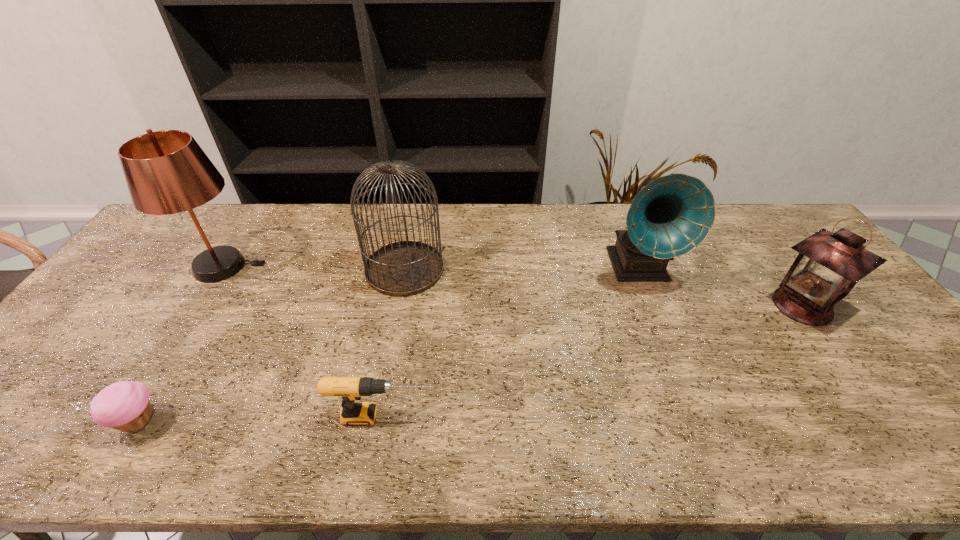
Find the location of a particular element. The width and height of the screenshot is (960, 540). vacant area situated 0.380m on the back of the oil lamp is located at coordinates (731, 207).

Identify the location of vacant area situated on the handle side of the fifth tallest object. (467, 416).

Locate an element on the screen. vacant position located 0.210m on the left of the cupcake is located at coordinates (21, 422).

You are a GUI agent. You are given a task and a screenshot of the screen. Output one action in this format:
    pyautogui.click(x=<x>, y=<y>)
    Task: Click on the lampshade that is at the far edge
    
    Given the screenshot: What is the action you would take?
    pyautogui.click(x=167, y=172)

You are a GUI agent. You are given a task and a screenshot of the screen. Output one action in this format:
    pyautogui.click(x=<x>, y=<y>)
    Task: Click on the birdcage that is at the far edge
    
    Given the screenshot: What is the action you would take?
    pyautogui.click(x=405, y=268)

This screenshot has width=960, height=540. In order to click on phonograph_record that is positioned at the far edge in this screenshot , I will do `click(669, 217)`.

At what (x,y) coordinates should I click in order to perform the action: click on drill that is at the near edge. Please return your answer as a coordinate pair (x, y). The width and height of the screenshot is (960, 540). Looking at the image, I should click on (350, 389).

The image size is (960, 540). Find the location of `cupcake that is positioned at the near edge`. cupcake that is positioned at the near edge is located at coordinates (125, 405).

Identify the location of object located in the right edge section of the desktop. (828, 266).

In the image, there is a desktop. In order to click on vacant space at the far edge in this screenshot , I will do `click(233, 206)`.